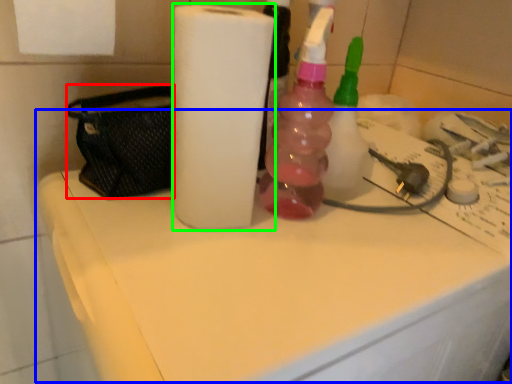
Question: Which object is the farthest from pouch (highlighted by a red box)? Choose among these: counter top (highlighted by a blue box) or paper towel (highlighted by a green box).

Choices:
 (A) counter top
 (B) paper towel

Answer: (A)